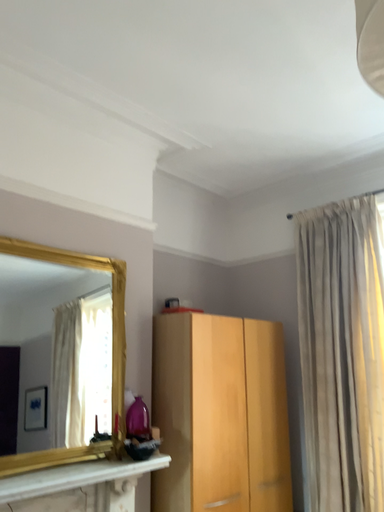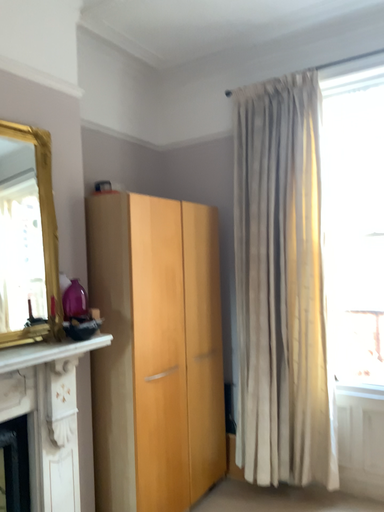
Question: How did the camera likely rotate when shooting the video?

Choices:
 (A) rotated left
 (B) rotated right

Answer: (B)